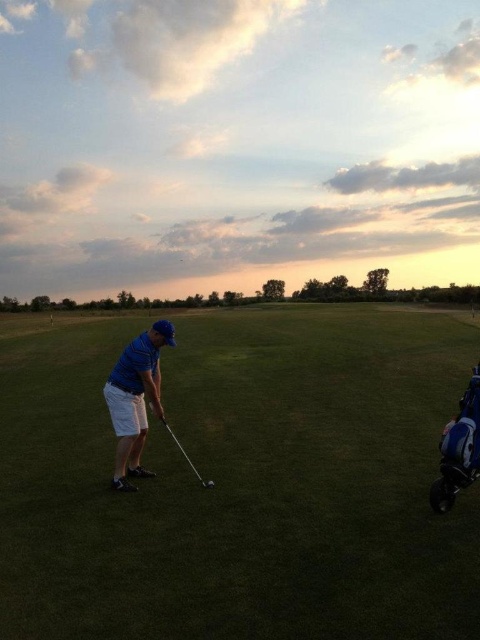
From the picture: Does blue cotton shirt at center appear on the left side of shiny silver golf ball at center?

Correct, you'll find blue cotton shirt at center to the left of shiny silver golf ball at center.

Who is higher up, blue cotton shirt at center or shiny silver golf ball at center?

blue cotton shirt at center is above.

Is point (144, 470) in front of point (212, 483)?

No, it is behind (212, 483).

You are a GUI agent. You are given a task and a screenshot of the screen. Output one action in this format:
    pyautogui.click(x=<x>, y=<y>)
    Task: Click on the blue cotton shirt at center
    Image resolution: width=480 pixels, height=640 pixels.
    Given the screenshot: What is the action you would take?
    pyautogui.click(x=134, y=397)

Does shiny metallic golf club at center have a lesser width compared to shiny silver golf ball at center?

Incorrect, shiny metallic golf club at center's width is not less than shiny silver golf ball at center's.

Does shiny metallic golf club at center come behind shiny silver golf ball at center?

That is True.

Which is in front, point (204, 483) or point (214, 484)?

Point (204, 483)

Locate an element on the screen. The width and height of the screenshot is (480, 640). shiny metallic golf club at center is located at coordinates (183, 452).

Does green grass at center have a smaller size compared to shiny metallic golf club at center?

No, green grass at center is not smaller than shiny metallic golf club at center.

Does green grass at center appear on the right side of shiny metallic golf club at center?

No, green grass at center is not to the right of shiny metallic golf club at center.

Is point (160, 451) farther from camera compared to point (195, 476)?

That is True.

Where is `green grass at center`? Image resolution: width=480 pixels, height=640 pixels. green grass at center is located at coordinates (240, 480).